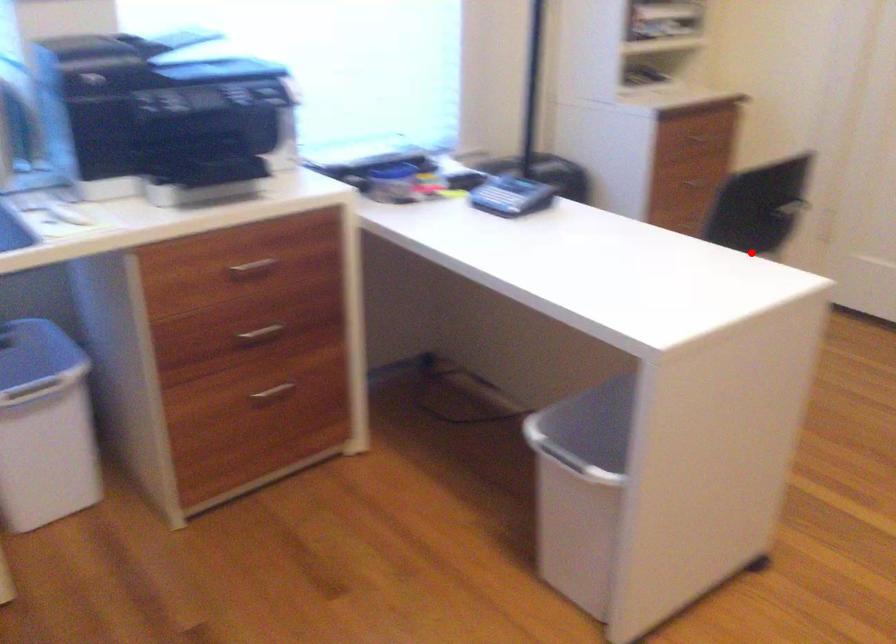
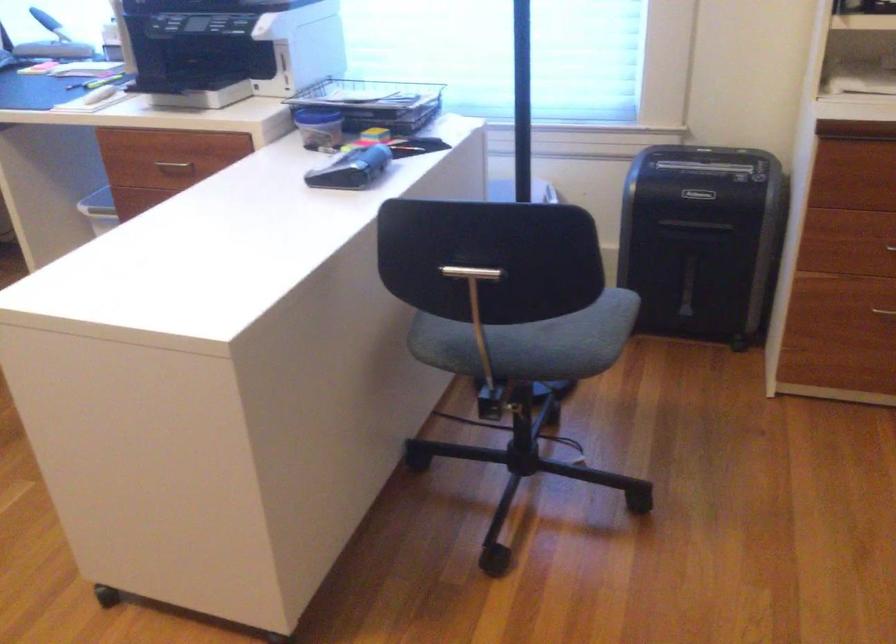
Question: I am providing you with two images of the same scene from different viewpoints. In image1, a red point is highlighted. Considering the same 3D point in image2, which of the following is correct?

Choices:
 (A) It is closer
 (B) It is farther

Answer: (A)